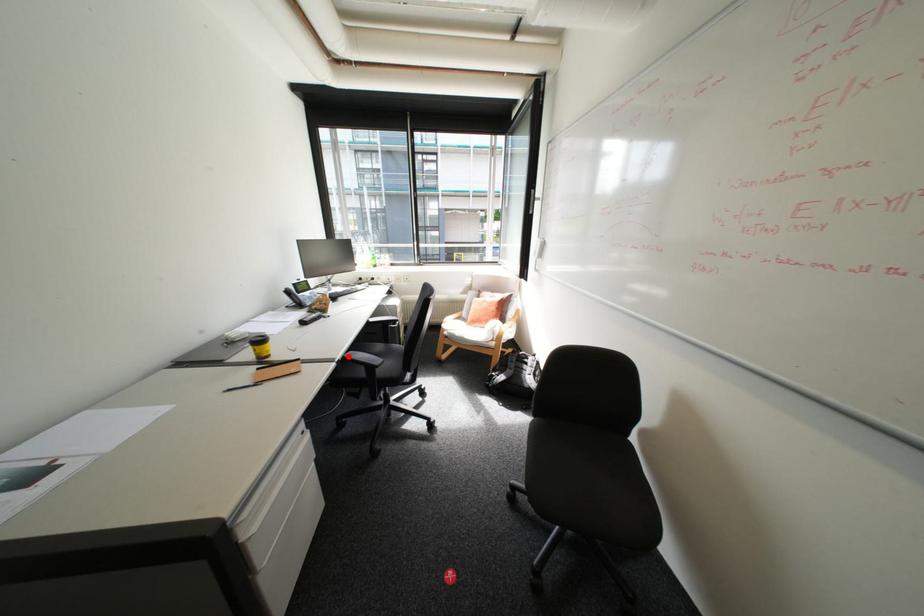
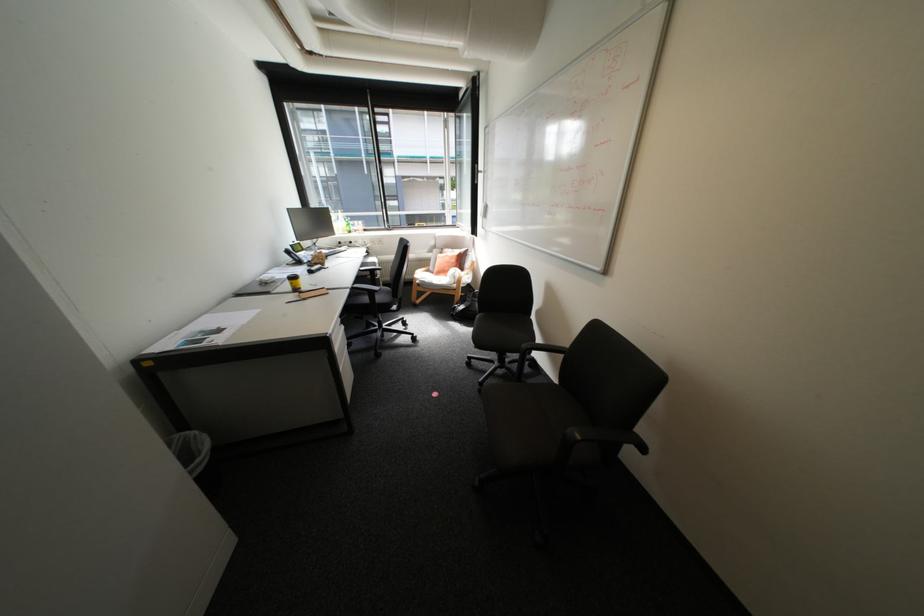
Question: I am providing you with two images of the same scene from different viewpoints. In image1, a red point is highlighted. Considering the same 3D point in image2, which of the following is correct?

Choices:
 (A) It is closer
 (B) It is farther

Answer: (B)